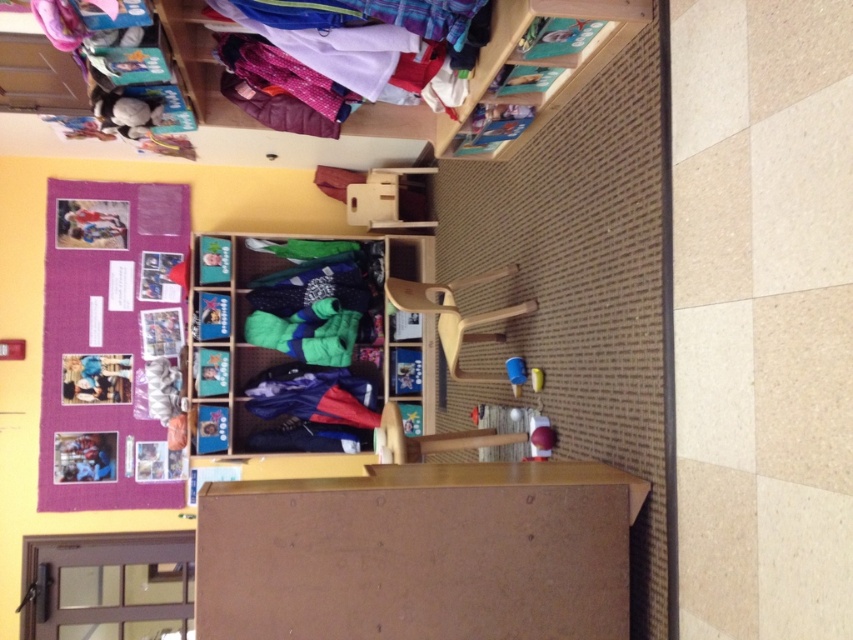
You are a teacher organizing the classroom. You want to place a new poster that is the same width as the soft fleece socks at center. Will the purple fabric bulletin board at upper left have enough space to fit this poster?

The purple fabric bulletin board at upper left has a width that surpasses the soft fleece socks at center. Therefore, the poster will fit on the bulletin board since its width is sufficient.

You are a parent trying to find your child a pair of socks and a jacket for a school event. You are standing in the center of the room. Which item is closer to you, the soft fleece socks at center or the shiny polyester jackets at upper center?

The soft fleece socks at center are closer to you since they are located at center, while the shiny polyester jackets at upper center are positioned higher up, making them farther away. The distance between them is 2.27 meters, so the socks are nearer.